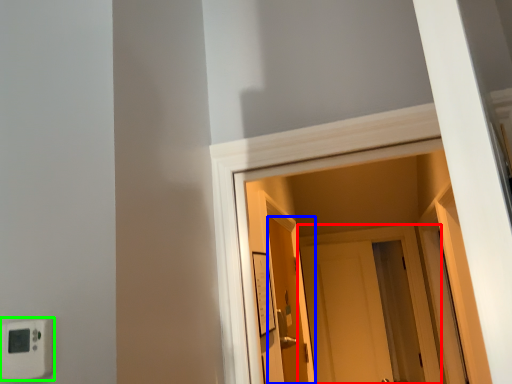
Question: Which is nearer to the door (highlighted by a red box)? door (highlighted by a blue box) or light switch (highlighted by a green box).

Choices:
 (A) door
 (B) light switch

Answer: (A)